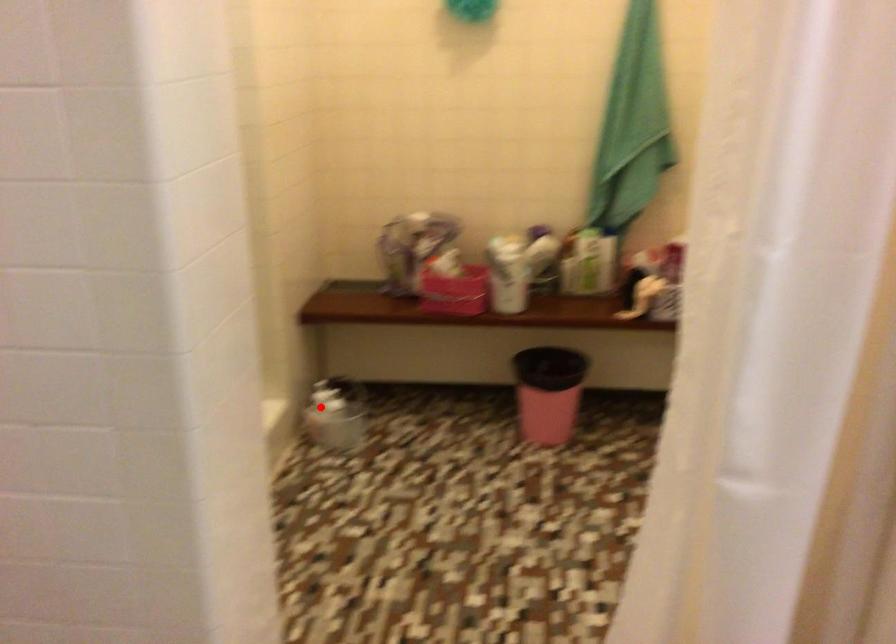
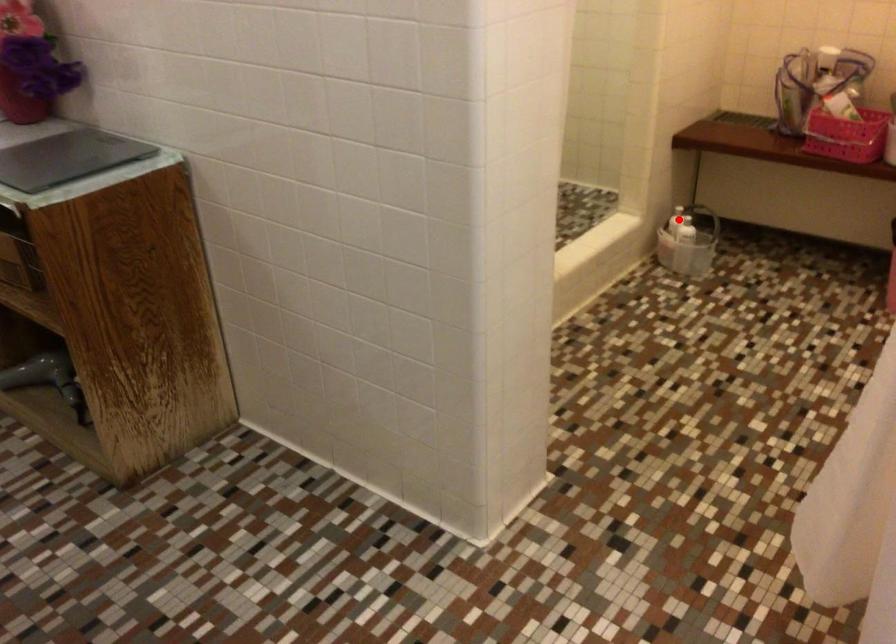
I am providing you with two images of the same scene from different viewpoints. A red point is marked on the first image and another point is marked on the second image. Does the point marked in image1 correspond to the same location as the one in image2?

Yes